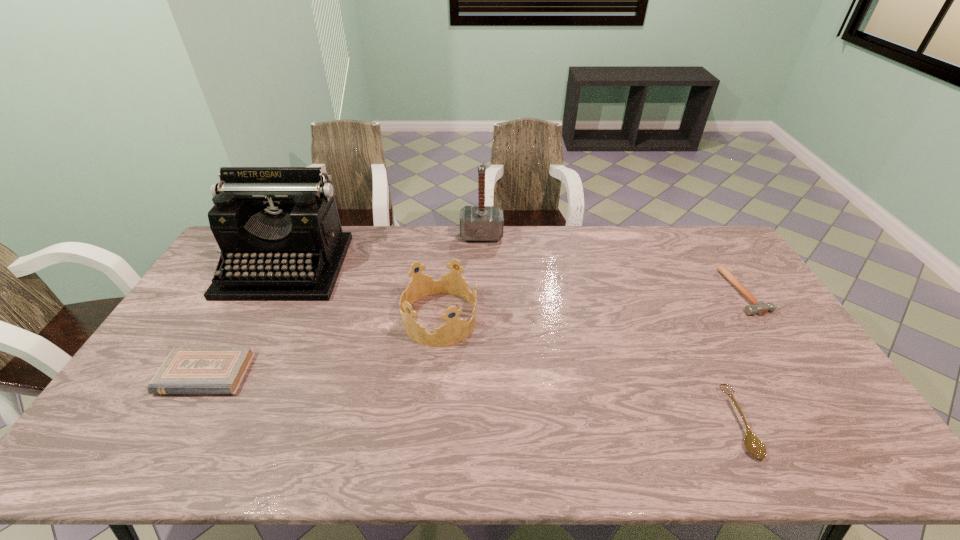
Image resolution: width=960 pixels, height=540 pixels. Identify the location of vacant area that lies between the Bible and the shortest object. (472, 398).

Find the location of `free spot between the third tallest object and the typewriter`. free spot between the third tallest object and the typewriter is located at coordinates (363, 293).

Identify the location of vacant area that lies between the farther hammer and the Bible. (344, 305).

Locate an element on the screen. The height and width of the screenshot is (540, 960). vacant region between the tiara and the Bible is located at coordinates pyautogui.click(x=323, y=346).

This screenshot has height=540, width=960. In order to click on blank region between the Bible and the rightmost object in this screenshot , I will do `click(475, 333)`.

This screenshot has height=540, width=960. I want to click on free space between the fifth object from left to right and the taller hammer, so click(611, 329).

Identify the location of blank region between the Bible and the taller hammer. (344, 305).

Find the location of a particular element. This screenshot has height=540, width=960. object that is the fourth closest to the typewriter is located at coordinates (754, 446).

This screenshot has width=960, height=540. I want to click on object that is the fifth closest to the Bible, so (x=761, y=308).

The width and height of the screenshot is (960, 540). I want to click on free space that satisfies the following two spatial constraints: 1. on the spine side of the shortest object; 2. on the left side of the Bible, so click(179, 422).